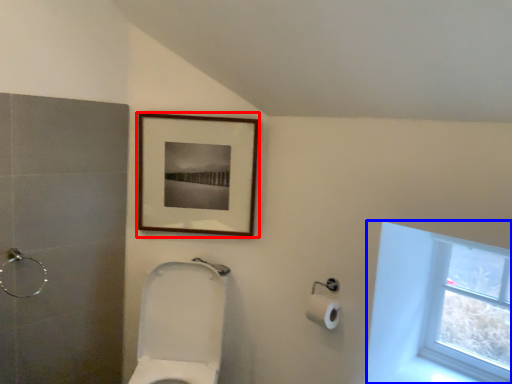
Question: Which of the following is the closest to the observer, picture frame (highlighted by a red box) or window (highlighted by a blue box)?

Choices:
 (A) picture frame
 (B) window

Answer: (B)